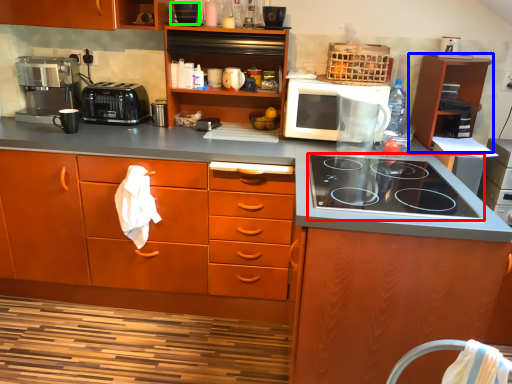
Question: Based on their relative distances, which object is nearer to gas stove (highlighted by a red box)? Choose from cabinetry (highlighted by a blue box) and appliance (highlighted by a green box).

Choices:
 (A) cabinetry
 (B) appliance

Answer: (A)